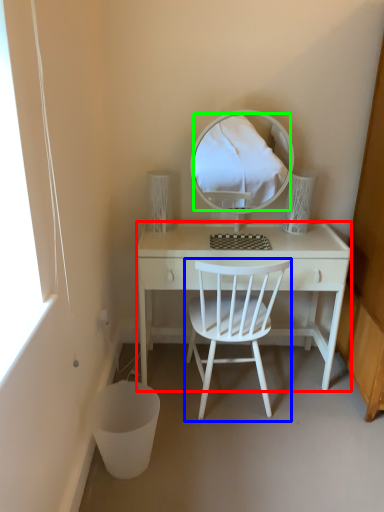
Question: Which is nearer to the desk (highlighted by a red box)? chair (highlighted by a blue box) or mirror (highlighted by a green box).

Choices:
 (A) chair
 (B) mirror

Answer: (A)